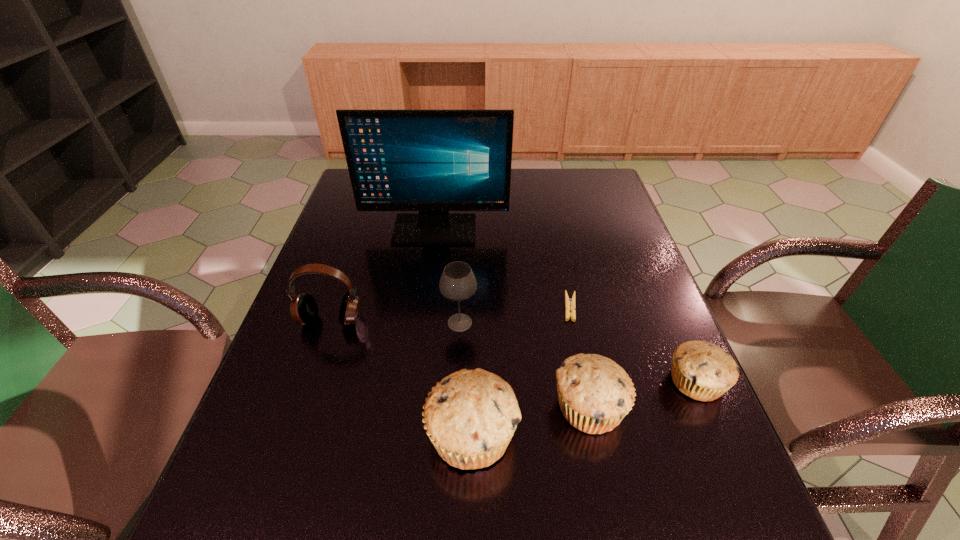
Identify the location of empty space that is in between the leftmost muffin and the monitor. (453, 332).

Identify the location of free space between the headset and the rightmost muffin. (514, 351).

Locate an element on the screen. The height and width of the screenshot is (540, 960). free space between the tallest object and the third shortest object is located at coordinates (513, 318).

Identify the location of vacant area that lies between the shortest muffin and the headset. This screenshot has height=540, width=960. (514, 351).

Identify the location of empty space that is in between the headset and the leftmost muffin. This screenshot has width=960, height=540. tap(401, 377).

The height and width of the screenshot is (540, 960). In order to click on object that stands as the closest to the wineglass in this screenshot , I will do coord(470,416).

This screenshot has height=540, width=960. Identify the location of object that is the third closest to the tallest object. coord(457,283).

Locate an element on the screen. This screenshot has width=960, height=540. muffin identified as the third closest to the headset is located at coordinates (701, 370).

Identify which muffin is the second nearest to the leftmost muffin. Please provide its 2D coordinates. Your answer should be formatted as a tuple, i.e. [(x, y)], where the tuple contains the x and y coordinates of a point satisfying the conditions above.

[(701, 370)]

Find the location of a particular element. The image size is (960, 540). vacant space that satisfies the following two spatial constraints: 1. on the ear pads of the wineglass; 2. on the left side of the headset is located at coordinates (330, 322).